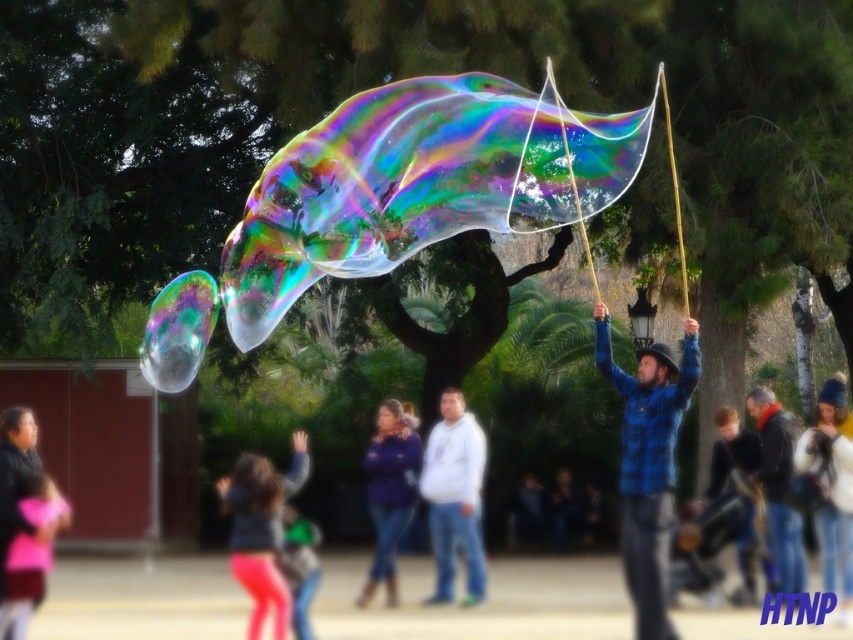
You are a photographer trying to capture the performer holding the bubble. You notice the blue plaid shirt at center is at point (648, 461). If you want to focus your camera on the blue plaid shirt at center, where should you aim your camera?

You should aim your camera directly at point (648, 461) to focus on the blue plaid shirt at center.

You are a photographer trying to capture the performer in the image. You notice the pink fabric pants at lower left and the blue denim jeans at center. Which pair of pants should you focus on to ensure the subject is in the foreground of your photo?

The pink fabric pants at lower left is in front of the blue denim jeans at center, so focusing on the pink fabric pants at lower left will ensure the subject is in the foreground.

You are a photographer trying to capture the performer and the bubble in the scene. You notice the blue plaid shirt at center and the pink fabric at lower left in your viewfinder. Which object is wider in the image?

The blue plaid shirt at center is wider than the pink fabric at lower left.